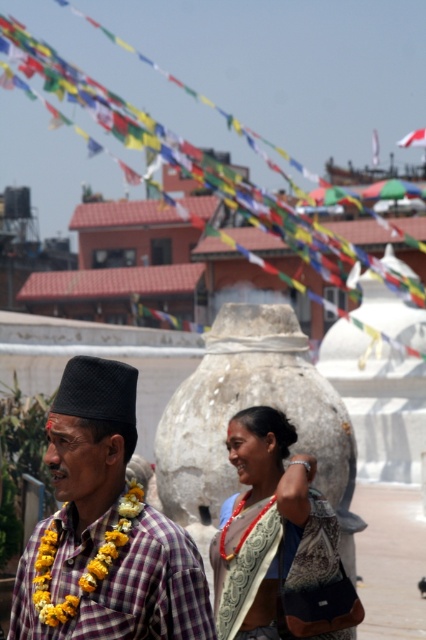
Question: Which of the following is the closest to the observer?

Choices:
 (A) (109, 388)
 (B) (261, 458)

Answer: (A)

Question: Considering the relative positions of plaid fabric shirt at center and matte gold necklace at center in the image provided, where is plaid fabric shirt at center located with respect to matte gold necklace at center?

Choices:
 (A) left
 (B) right

Answer: (A)

Question: Is plaid fabric shirt at center positioned before matte gold necklace at center?

Choices:
 (A) yes
 (B) no

Answer: (A)

Question: Which point is farther from the camera taking this photo?

Choices:
 (A) (316, 465)
 (B) (86, 480)

Answer: (A)

Question: Is plaid fabric shirt at center below matte gold necklace at center?

Choices:
 (A) no
 (B) yes

Answer: (A)